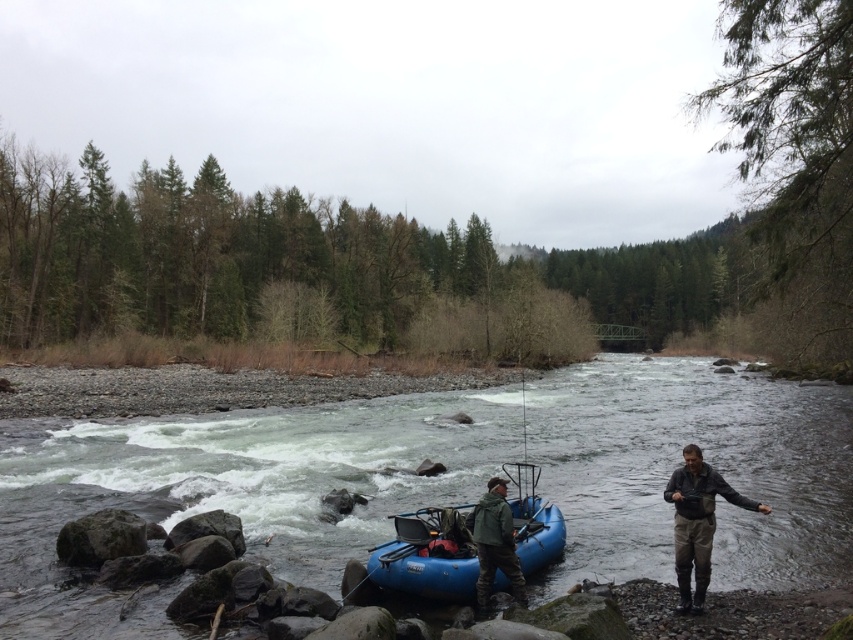
Measure the distance between blue rubber boat at center and camera.

They are 9.54 meters apart.

Which of these two, blue rubber boat at center or green matte jacket at lower center, stands shorter?

With less height is blue rubber boat at center.

Describe the element at coordinates (422, 557) in the screenshot. I see `blue rubber boat at center` at that location.

At what (x,y) coordinates should I click in order to perform the action: click on blue rubber boat at center. Please return your answer as a coordinate pair (x, y). Looking at the image, I should click on (422, 557).

Can you confirm if blue rubber raft at lower center is positioned to the left of khaki cotton pants at lower right?

Incorrect, blue rubber raft at lower center is not on the left side of khaki cotton pants at lower right.

Which is behind, point (636, 570) or point (701, 557)?

The point (636, 570) is behind.

Between point (474, 476) and point (682, 548), which one is positioned in front?

Point (682, 548) is more forward.

Identify the location of blue rubber raft at lower center. (231, 492).

Can you confirm if blue rubber raft at lower center is shorter than green matte jacket at lower center?

Correct, blue rubber raft at lower center is not as tall as green matte jacket at lower center.

Consider the image. Is blue rubber raft at lower center closer to the viewer compared to green matte jacket at lower center?

That is True.

This screenshot has height=640, width=853. I want to click on blue rubber raft at lower center, so click(x=231, y=492).

The image size is (853, 640). What are the coordinates of `blue rubber raft at lower center` in the screenshot? It's located at (231, 492).